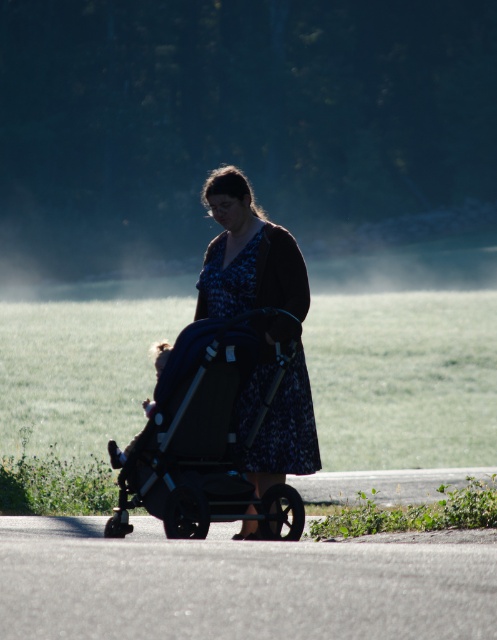
Is blue floral dress at center above white fluffy baby at center?

Indeed, blue floral dress at center is positioned over white fluffy baby at center.

Between point (243, 429) and point (126, 449), which one is positioned behind?

The point (243, 429) is more distant.

Who is more forward, (298, 266) or (111, 461)?

Point (111, 461) is in front.

At what (x,y) coordinates should I click in order to perform the action: click on blue floral dress at center. Please return your answer as a coordinate pair (x, y). This screenshot has height=640, width=497. Looking at the image, I should click on (247, 253).

Is matte black stroller at center above blue floral dress at center?

No.

In order to click on matte black stroller at center in this screenshot , I will do `click(204, 436)`.

Locate an element on the screen. The height and width of the screenshot is (640, 497). matte black stroller at center is located at coordinates (204, 436).

Identify the location of matte black stroller at center. This screenshot has height=640, width=497. (204, 436).

Is point (398, 51) closer to camera compared to point (239, 243)?

No, (398, 51) is behind (239, 243).

How distant is foggy mist at center from blue floral dress at center?

5.67 meters

Is point (308, 10) farther from viewer compared to point (265, 424)?

Yes, point (308, 10) is farther from viewer.

The image size is (497, 640). What are the coordinates of `foggy mist at center` in the screenshot? It's located at (237, 124).